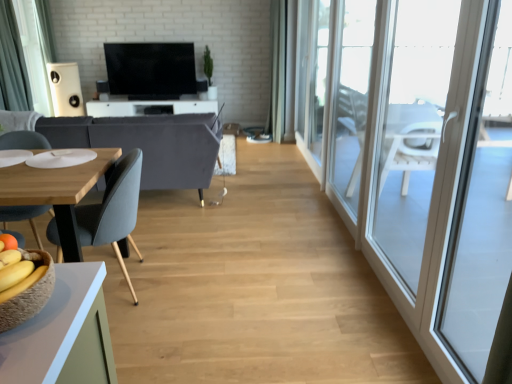
The height and width of the screenshot is (384, 512). I want to click on matte gray chair at left, so click(x=114, y=211).

Describe the element at coordinates (351, 98) in the screenshot. I see `transparent glass door at right, which is the second window from back to front` at that location.

This screenshot has height=384, width=512. What do you see at coordinates (57, 191) in the screenshot? I see `wooden table at lower left, which appears as the second table when viewed from the top` at bounding box center [57, 191].

Find the location of a particular element. Image resolution: width=512 pixels, height=384 pixels. transparent glass door at right, which appears as the third window when viewed from the back is located at coordinates (412, 130).

Can you confirm if matte gray chair at left is wider than transparent glass window at right, the 3th window from the front?

Yes, matte gray chair at left is wider than transparent glass window at right, the 3th window from the front.

Is matte gray chair at left facing towards transparent glass window at right, the 3th window from the front?

No.

Considering the relative sizes of matte gray chair at left and transparent glass window at right, marked as the 1th window in a back-to-front arrangement, in the image provided, is matte gray chair at left bigger than transparent glass window at right, marked as the 1th window in a back-to-front arrangement,?

Yes, matte gray chair at left is bigger than transparent glass window at right, marked as the 1th window in a back-to-front arrangement.

Considering the relative positions of matte gray chair at left and transparent glass window at right, the 3th window from the front, in the image provided, is matte gray chair at left to the left of transparent glass window at right, the 3th window from the front, from the viewer's perspective?

Yes, matte gray chair at left is to the left of transparent glass window at right, the 3th window from the front.

Does velvet grey couch at left have a smaller size compared to white matte speaker at upper left?

No.

Relative to white matte speaker at upper left, is velvet grey couch at left in front or behind?

Clearly, velvet grey couch at left is in front of white matte speaker at upper left.

Does yellow matte bananas at lower left have a smaller size compared to velvet grey couch at left?

Indeed, yellow matte bananas at lower left has a smaller size compared to velvet grey couch at left.

Consider the image. From a real-world perspective, relative to velvet grey couch at left, is yellow matte bananas at lower left vertically above or below?

From a real-world perspective, yellow matte bananas at lower left is physically above velvet grey couch at left.

Between yellow matte bananas at lower left and velvet grey couch at left, which one is positioned in front?

yellow matte bananas at lower left is in front.

Based on their positions, is yellow matte bananas at lower left located to the left or right of velvet grey couch at left?

yellow matte bananas at lower left is to the right of velvet grey couch at left.

In the image, is matte gray chair at left positioned in front of or behind transparent glass screen door at right?

Clearly, matte gray chair at left is behind transparent glass screen door at right.

From the image's perspective, which one is positioned lower, matte gray chair at left or transparent glass screen door at right?

matte gray chair at left, from the image's perspective.

Does point (120, 230) come closer to viewer compared to point (375, 128)?

Yes, point (120, 230) is in front of point (375, 128).

What's the angular difference between matte gray chair at left and transparent glass screen door at right's facing directions?

6.73 degrees.

In the scene shown: Which is correct: dark gray fabric curtain at left is inside transparent glass door at right, arranged as the 1th window when viewed from the front, or outside of it?

dark gray fabric curtain at left is located beyond the bounds of transparent glass door at right, arranged as the 1th window when viewed from the front.

Is dark gray fabric curtain at left positioned with its back to transparent glass door at right, arranged as the 1th window when viewed from the front?

No.

From a real-world perspective, is dark gray fabric curtain at left positioned under transparent glass door at right, arranged as the 1th window when viewed from the front, based on gravity?

No, from a real-world perspective, dark gray fabric curtain at left is not beneath transparent glass door at right, arranged as the 1th window when viewed from the front.

Is dark gray fabric curtain at left next to transparent glass door at right, arranged as the 1th window when viewed from the front, and touching it?

dark gray fabric curtain at left is not next to transparent glass door at right, arranged as the 1th window when viewed from the front, and they're not touching.

Between yellow matte bananas at lower left and transparent glass screen door at right, which one has smaller width?

transparent glass screen door at right.

Is yellow matte bananas at lower left not close to transparent glass screen door at right?

Yes, yellow matte bananas at lower left and transparent glass screen door at right are quite far apart.

Could you tell me if yellow matte bananas at lower left is facing transparent glass screen door at right?

No, yellow matte bananas at lower left is not aimed at transparent glass screen door at right.

How distant is yellow matte bananas at lower left from transparent glass screen door at right?

yellow matte bananas at lower left and transparent glass screen door at right are 2.95 meters apart from each other.

Does point (52, 63) come farther from viewer compared to point (351, 42)?

Yes, point (52, 63) is farther from viewer.

Is white matte speaker at upper left not near transparent glass door at right, which is the second window from back to front?

Yes.

Is white matte speaker at upper left wider or thinner than transparent glass door at right, the second window in the front-to-back sequence?

Clearly, white matte speaker at upper left has more width compared to transparent glass door at right, the second window in the front-to-back sequence.

Does white matte speaker at upper left turn towards transparent glass door at right, which is the second window from back to front?

No, white matte speaker at upper left does not turn towards transparent glass door at right, which is the second window from back to front.

Which window is the 1st one when counting from the right side of the matte gray chair at left? Please provide its 2D coordinates.

[(318, 77)]

Locate an element on the screen. The width and height of the screenshot is (512, 384). speaker behind the velvet grey couch at left is located at coordinates (65, 89).

Based on their spatial positions, is transparent glass window at right, the 3th window from the front, or transparent glass screen door at right closer to transparent glass door at right, the second window in the front-to-back sequence?

transparent glass window at right, the 3th window from the front, is positioned closer to the anchor transparent glass door at right, the second window in the front-to-back sequence.

Which object lies nearer to the anchor point transparent glass screen door at right, flat screen tv at center or transparent glass window at right, the 3th window from the front?

transparent glass window at right, the 3th window from the front, lies closer to transparent glass screen door at right than the other object.

Looking at the image, which one is located further to transparent glass door at right, which is the second window from back to front, transparent glass screen door at right or transparent glass window at right, the 3th window from the front?

Based on the image, transparent glass screen door at right appears to be further to transparent glass door at right, which is the second window from back to front.

Based on their spatial positions, is transparent glass window at right, the 3th window from the front, or flat screen tv at center closer to transparent glass screen door at right?

transparent glass window at right, the 3th window from the front, is closer to transparent glass screen door at right.

Considering their positions, is dark gray fabric curtain at left positioned closer to matte gray chair at left than transparent glass door at right, which is the second window from back to front?

transparent glass door at right, which is the second window from back to front, is closer to matte gray chair at left.

When comparing their distances from flat screen tv at center, does yellow matte bananas at lower left or transparent glass screen door at right seem further?

Based on the image, yellow matte bananas at lower left appears to be further to flat screen tv at center.

Estimate the real-world distances between objects in this image. Which object is further from transparent glass door at right, which is the second window from back to front, transparent glass door at right, which appears as the third window when viewed from the back, or white glossy tv stand at center, the second table positioned from the bottom?

The object further to transparent glass door at right, which is the second window from back to front, is white glossy tv stand at center, the second table positioned from the bottom.

From the image, which object appears to be farther from velvet grey couch at left, white matte speaker at upper left or white glossy tv stand at center, the second table positioned from the bottom?

white matte speaker at upper left is further to velvet grey couch at left.

Identify the location of banana between wooden table at lower left, which ranks as the first table in front-to-back order, and transparent glass door at right, which appears as the third window when viewed from the back, from left to right. (23, 284).

Find the location of `chair located between wooden table at lower left, which appears as the second table when viewed from the top, and velvet grey couch at left in the depth direction`. chair located between wooden table at lower left, which appears as the second table when viewed from the top, and velvet grey couch at left in the depth direction is located at coordinates (114, 211).

The image size is (512, 384). I want to click on speaker between matte gray chair at left and flat screen tv at center along the z-axis, so click(x=65, y=89).

At what (x,y) coordinates should I click in order to perform the action: click on table between yellow matte bananas at lower left and white glossy tv stand at center, the first table in the top-to-bottom sequence, in the front-back direction. Please return your answer as a coordinate pair (x, y). Looking at the image, I should click on tap(57, 191).